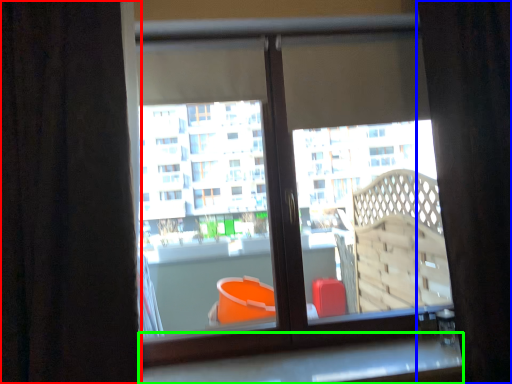
Question: Considering the real-world distances, which object is closest to curtain (highlighted by a red box)? curtain (highlighted by a blue box) or window sill (highlighted by a green box).

Choices:
 (A) curtain
 (B) window sill

Answer: (B)